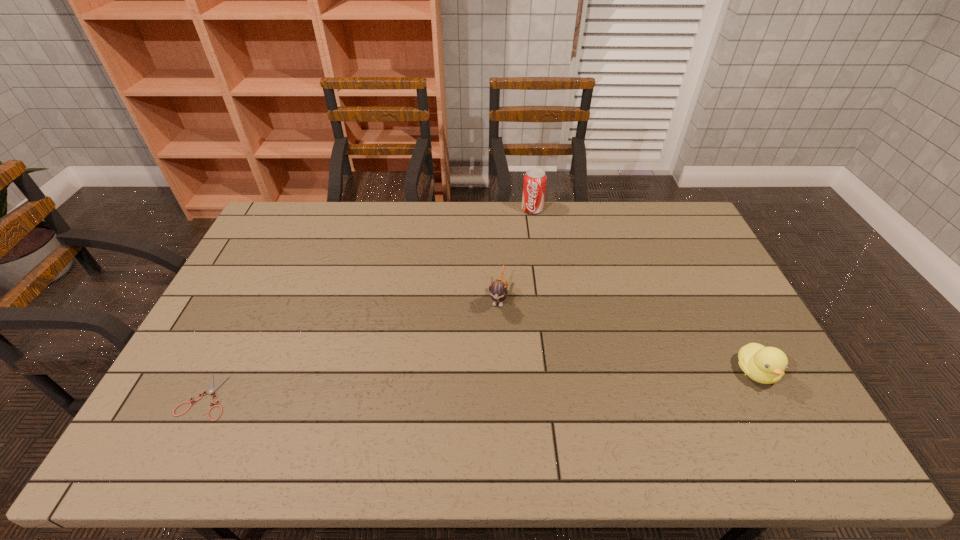
I want to click on free space located 0.210m on the front-facing side of the second farthest object, so click(x=485, y=375).

Image resolution: width=960 pixels, height=540 pixels. I want to click on free space located on the front-facing side of the second farthest object, so click(478, 413).

What are the coordinates of `vacant position located 0.170m on the logo side of the second object from right to left` in the screenshot? It's located at [519, 243].

Locate an element on the screen. This screenshot has width=960, height=540. free space located 0.050m on the logo side of the second object from right to left is located at coordinates (527, 223).

Where is `free region located 0.190m on the logo side of the second object from right to left`? This screenshot has width=960, height=540. free region located 0.190m on the logo side of the second object from right to left is located at coordinates (518, 246).

I want to click on object that is at the far edge, so click(x=534, y=184).

Locate an element on the screen. shears at the near edge is located at coordinates (211, 389).

The image size is (960, 540). Find the location of `duckling positioned at the near edge`. duckling positioned at the near edge is located at coordinates (766, 365).

Where is `object that is at the left edge`? The height and width of the screenshot is (540, 960). object that is at the left edge is located at coordinates (211, 389).

What are the coordinates of `object that is at the right edge` in the screenshot? It's located at (766, 365).